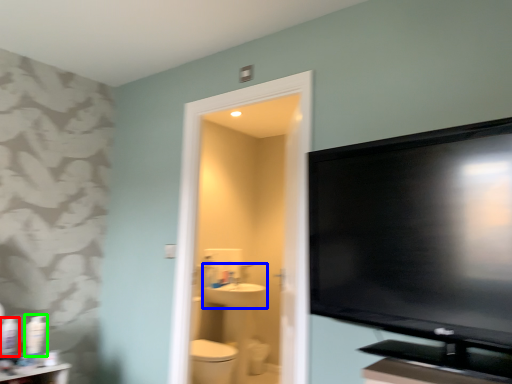
Question: Which object is positioned farthest from toiletry (highlighted by a red box)? Select from sink (highlighted by a blue box) and toiletry (highlighted by a green box).

Choices:
 (A) sink
 (B) toiletry

Answer: (A)